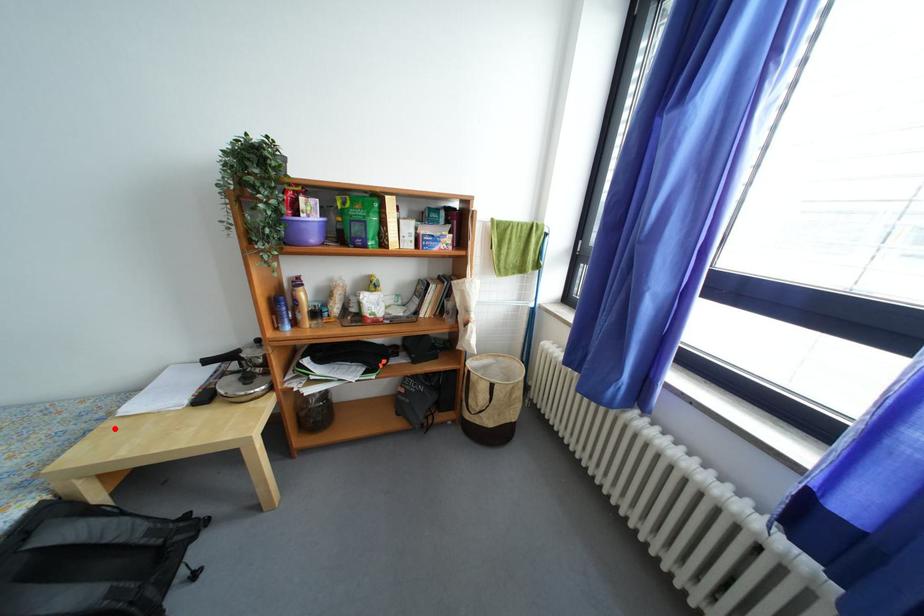
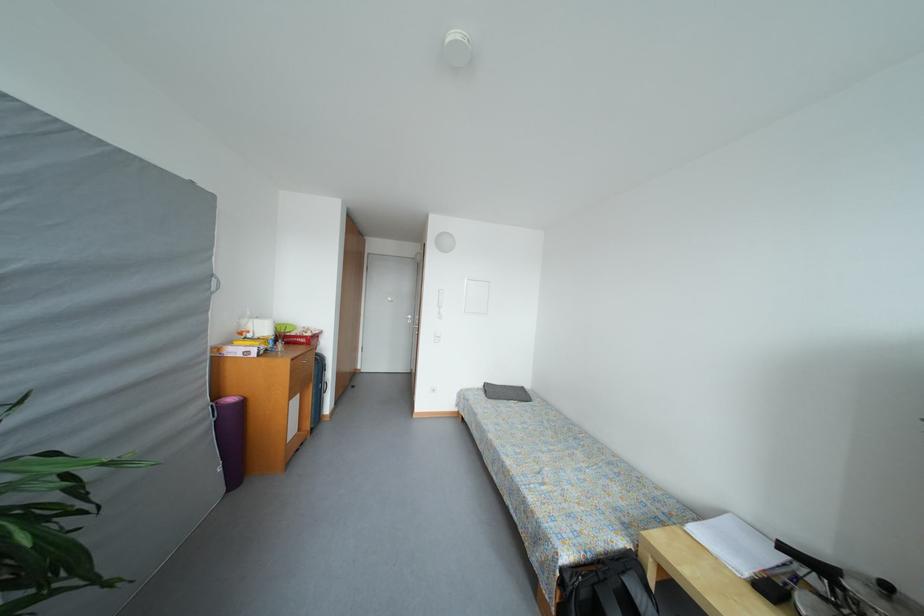
Question: I am providing you with two images of the same scene from different viewpoints. A red point is shown in image1. For the corresponding object point in image2, is it positioned nearer or farther from the camera?

Choices:
 (A) Nearer
 (B) Farther

Answer: (B)